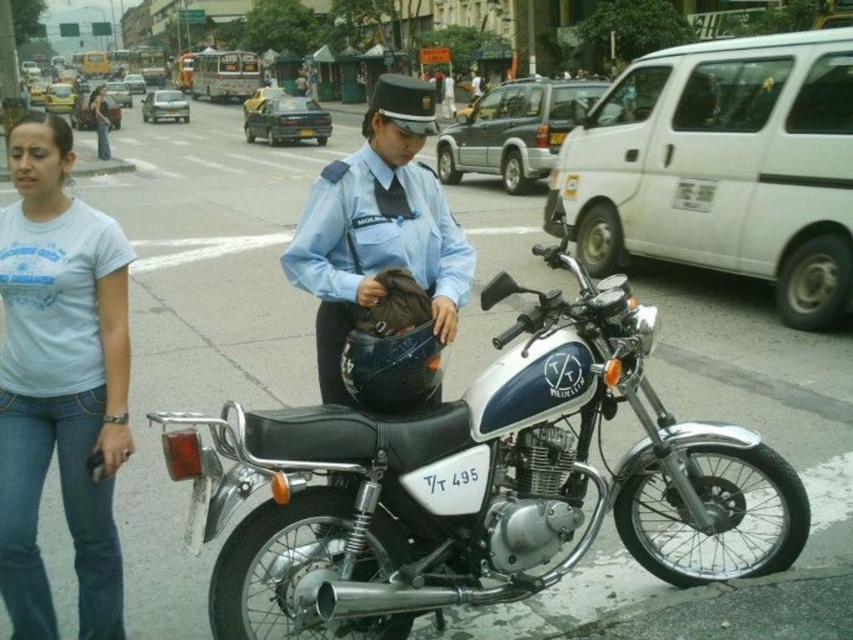
You are a delivery person who needs to park your motorcycle in a designated parking spot located at point 0.758, 0.560. Is the white metallic motorcycle at center currently occupying that spot?

The white metallic motorcycle at center is located exactly at point (477, 484), so yes, it is occupying the parking spot at that coordinate.